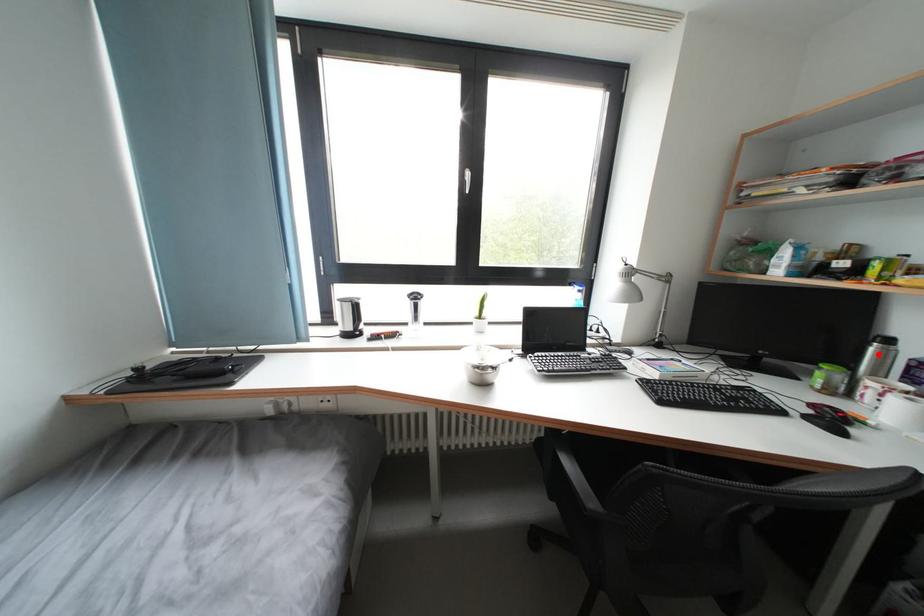
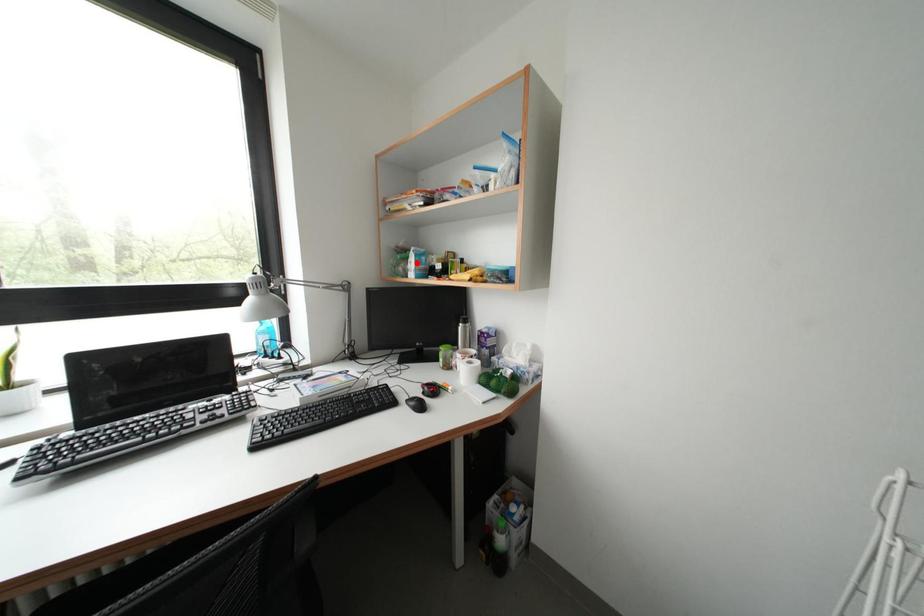
I am providing you with two images of the same scene from different viewpoints. A red point is marked on the first image and another point is marked on the second image. Does the point marked in image1 correspond to the same location as the one in image2?

No